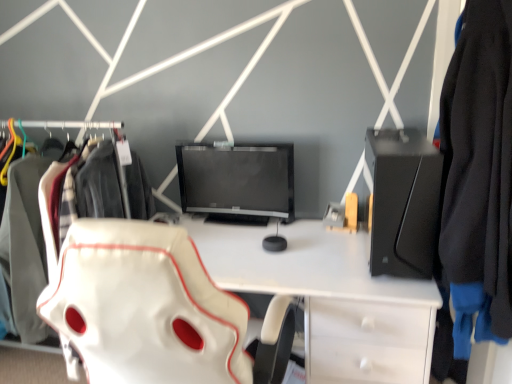
You are a GUI agent. You are given a task and a screenshot of the screen. Output one action in this format:
    pyautogui.click(x=<x>, y=<y>)
    Task: Click on the vacant area that lies between matte black monitor at center and black matte desktop at right
    This screenshot has width=512, height=384.
    Given the screenshot: What is the action you would take?
    pyautogui.click(x=314, y=244)